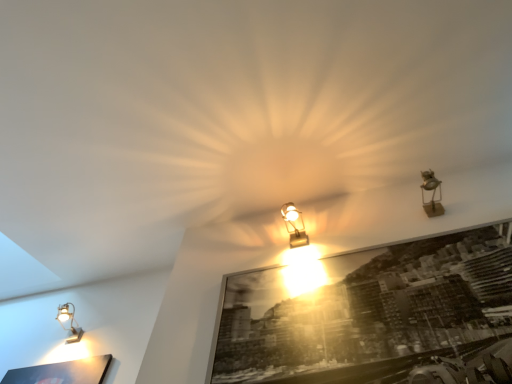
Question: Does point (302, 230) appear closer or farther from the camera than point (71, 329)?

Choices:
 (A) closer
 (B) farther

Answer: (A)

Question: In the image, is matte gold lamp at center, placed as the 2th lamp when sorted from back to front, positioned in front of or behind matte silver lamp at lower left, arranged as the third lamp when viewed from the right?

Choices:
 (A) front
 (B) behind

Answer: (A)

Question: Considering the real-world distances, which object is closest to the matte gold lamp at center, the second lamp ordered from the bottom?

Choices:
 (A) black glossy picture frame at center
 (B) matte silver lamp at lower left, arranged as the 1th lamp when viewed from the left
 (C) metallic gold spotlight at upper right, the first lamp when ordered from right to left

Answer: (A)

Question: Which object is positioned farthest from the matte silver lamp at lower left, arranged as the third lamp when viewed from the right?

Choices:
 (A) black glossy picture frame at center
 (B) matte gold lamp at center, placed as the second lamp when sorted from front to back
 (C) metallic gold spotlight at upper right, the 1th lamp from the top

Answer: (C)